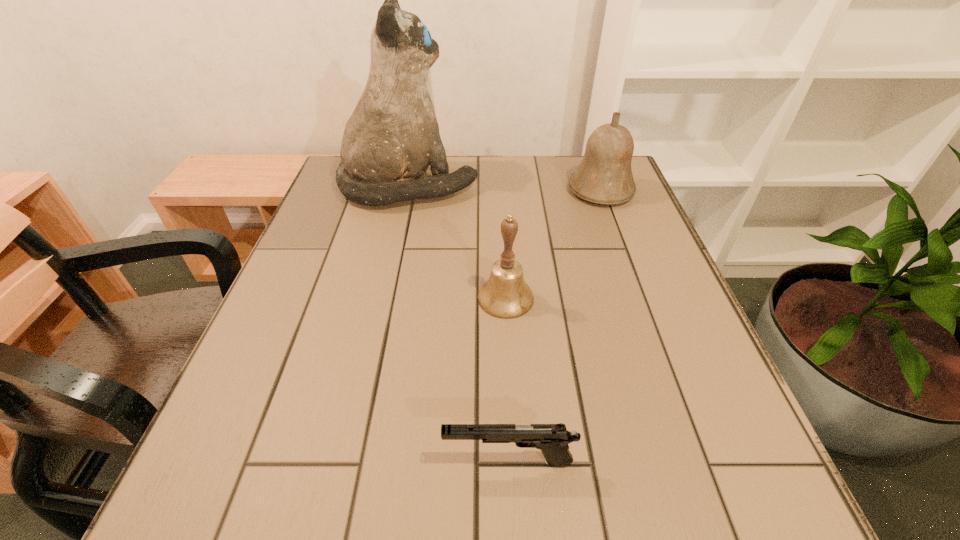
Identify the location of free region located at the aiming end of the nearest object. Image resolution: width=960 pixels, height=540 pixels. (290, 461).

Where is `free spot located 0.170m at the aiming end of the nearest object`? free spot located 0.170m at the aiming end of the nearest object is located at coordinates (330, 461).

Where is `vacant area located 0.120m at the aiming end of the nearest object`? vacant area located 0.120m at the aiming end of the nearest object is located at coordinates (364, 461).

I want to click on cat that is at the far edge, so click(391, 138).

Image resolution: width=960 pixels, height=540 pixels. What are the coordinates of `bell that is at the far edge` in the screenshot? It's located at (604, 176).

Identify the location of object that is positioned at the near edge. (552, 439).

The height and width of the screenshot is (540, 960). I want to click on object that is positioned at the left edge, so click(x=391, y=138).

Where is `object present at the right edge`? object present at the right edge is located at coordinates (604, 176).

This screenshot has width=960, height=540. In order to click on object located in the far left corner section of the desktop in this screenshot , I will do `click(391, 138)`.

You are a GUI agent. You are given a task and a screenshot of the screen. Output one action in this format:
    pyautogui.click(x=<x>, y=<y>)
    Task: Click on the object present at the far right corner
    
    Given the screenshot: What is the action you would take?
    pyautogui.click(x=604, y=176)